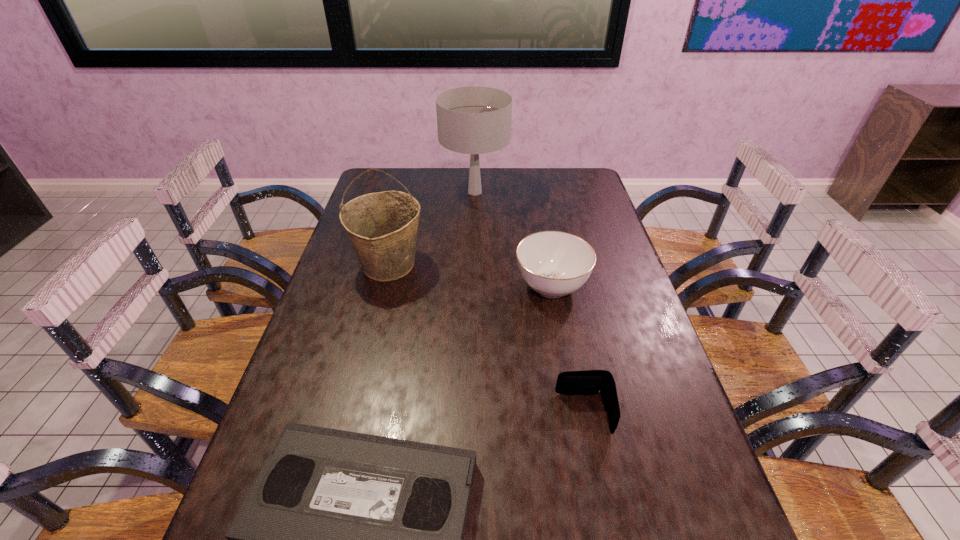
Image resolution: width=960 pixels, height=540 pixels. I want to click on lampshade, so click(x=474, y=120).

Image resolution: width=960 pixels, height=540 pixels. Find the location of `wine bucket`. wine bucket is located at coordinates (382, 227).

Locate an element on the screen. chinaware is located at coordinates (554, 264).

Locate an element on the screen. The height and width of the screenshot is (540, 960). wallet is located at coordinates (590, 382).

Where is `free spot located 0.130m on the front-facing side of the lampshade`? This screenshot has height=540, width=960. free spot located 0.130m on the front-facing side of the lampshade is located at coordinates (474, 231).

The width and height of the screenshot is (960, 540). I want to click on free space located 0.160m on the back of the wine bucket, so click(x=401, y=215).

At what (x,y) coordinates should I click in order to perform the action: click on blank space located 0.340m on the left of the third tallest object. Please return your answer as a coordinate pair (x, y). Looking at the image, I should click on (397, 286).

Image resolution: width=960 pixels, height=540 pixels. I want to click on blank area located on the outer surface of the wallet, so click(x=413, y=414).

I want to click on free space located 0.350m on the outer surface of the wallet, so click(x=398, y=414).

The width and height of the screenshot is (960, 540). In order to click on vacant region located on the outer surface of the wallet in this screenshot , I will do `click(413, 414)`.